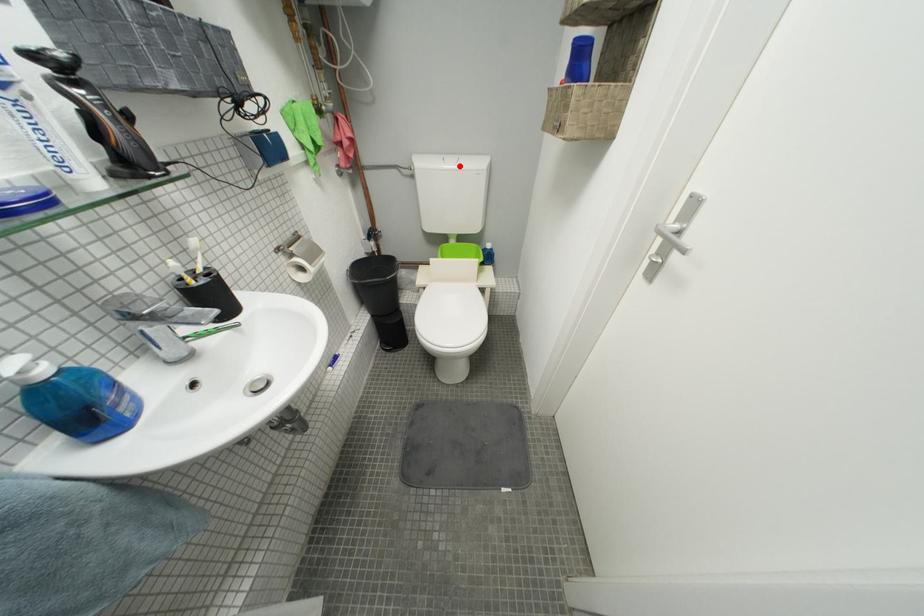
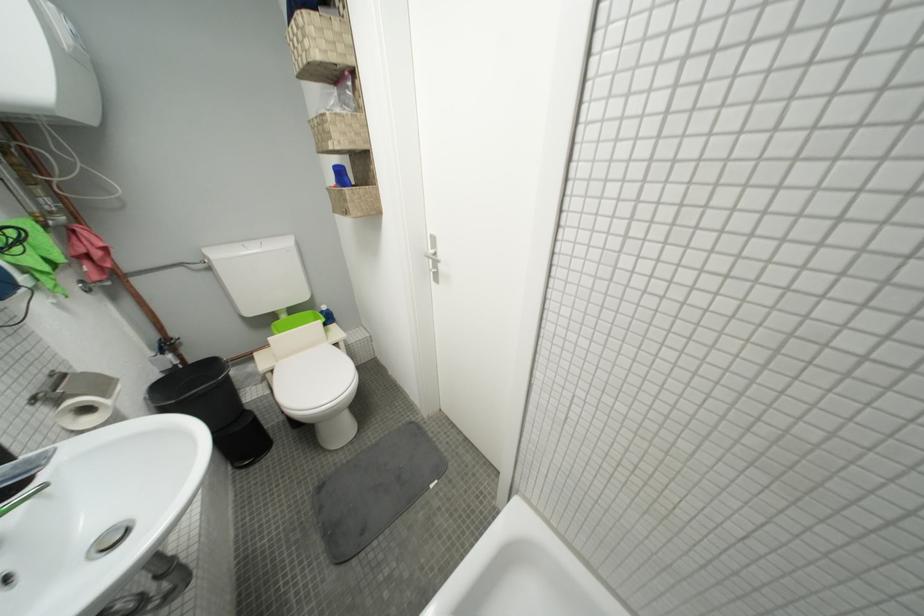
Find the pixel in the second image that matches the highlighted location in the first image.

(262, 252)